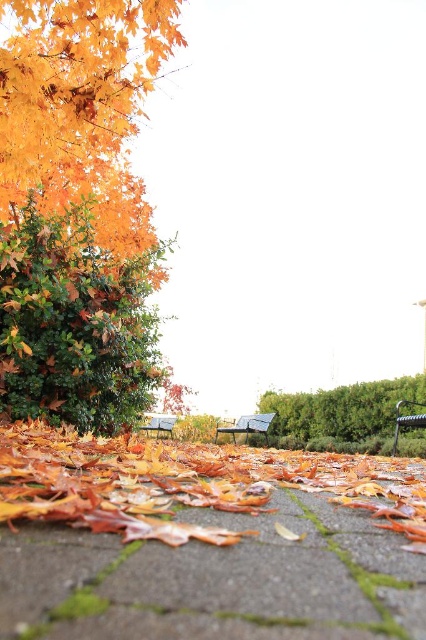
Question: Which object appears farthest from the camera in this image?

Choices:
 (A) green leafy hedge at lower right
 (B) wooden park bench at center

Answer: (A)

Question: Can you confirm if orange leaf litter at lower center is thinner than green leafy hedge at lower right?

Choices:
 (A) yes
 (B) no

Answer: (B)

Question: Is green leafy hedge at lower right closer to the viewer compared to wooden bench at center?

Choices:
 (A) yes
 (B) no

Answer: (A)

Question: Which of the following is the closest to the observer?

Choices:
 (A) metallic blue bench at center
 (B) green leafy hedge at lower right
 (C) brown concrete pavement at lower center
 (D) wooden bench at center

Answer: (C)

Question: Is the position of green leafy hedge at lower right more distant than that of wooden bench at center?

Choices:
 (A) yes
 (B) no

Answer: (B)

Question: Which point appears closest to the camera in this image?

Choices:
 (A) (92, 168)
 (B) (403, 401)
 (C) (357, 410)

Answer: (B)